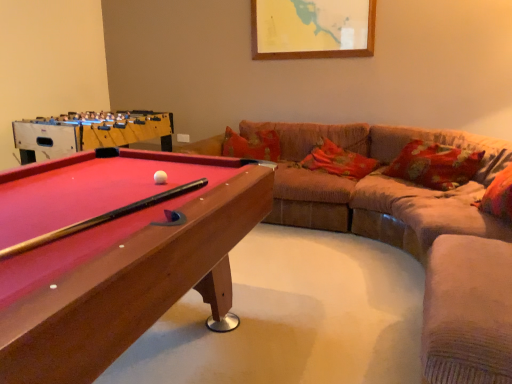
In order to face velvet beige couch at right, should I rotate leftwards or rightwards?

You should rotate right by 10.676 degrees.

Find the location of a particular element. Image resolution: width=512 pixels, height=384 pixels. wooden billiard table at left is located at coordinates (114, 254).

This screenshot has height=384, width=512. Describe the element at coordinates (338, 161) in the screenshot. I see `floral fabric pillow at center, the third pillow in the front-to-back sequence` at that location.

This screenshot has width=512, height=384. What are the coordinates of `fluffy fabric pillow at right, which is the 1th pillow from front to back` in the screenshot? It's located at (498, 196).

From the picture: Does floral fabric pillow at center, the 1th pillow from the back, have a lesser height compared to velvet beige couch at right?

Correct, floral fabric pillow at center, the 1th pillow from the back, is not as tall as velvet beige couch at right.

From a real-world perspective, is floral fabric pillow at center, the 1th pillow from the back, physically above velvet beige couch at right?

Correct, in the physical world, floral fabric pillow at center, the 1th pillow from the back, is higher than velvet beige couch at right.

Measure the distance between floral fabric pillow at center, the third pillow in the front-to-back sequence, and velvet beige couch at right.

floral fabric pillow at center, the third pillow in the front-to-back sequence, is 18.41 inches away from velvet beige couch at right.

Is floral fabric pillow at center, the 1th pillow from the back, beside velvet beige couch at right?

No, floral fabric pillow at center, the 1th pillow from the back, is not beside velvet beige couch at right.

Considering the sizes of objects velvet beige couch at right and white matte ball at center in the image provided, who is shorter, velvet beige couch at right or white matte ball at center?

white matte ball at center is shorter.

Is velvet beige couch at right thinner than white matte ball at center?

No.

Considering the sizes of velvet beige couch at right and white matte ball at center in the image, is velvet beige couch at right bigger or smaller than white matte ball at center?

In the image, velvet beige couch at right appears to be larger than white matte ball at center.

Is the position of smooth wood pool table at left more distant than that of fluffy fabric pillow at right, the third pillow in the back-to-front sequence?

Yes, it is.

Between point (48, 154) and point (494, 216), which one is positioned in front?

Positioned in front is point (494, 216).

Which object is positioned more to the left, smooth wood pool table at left or fluffy fabric pillow at right, the third pillow in the back-to-front sequence?

smooth wood pool table at left is more to the left.

How different are the orientations of smooth wood pool table at left and fluffy fabric pillow at right, the third pillow in the back-to-front sequence, in degrees?

162 degrees separate the facing orientations of smooth wood pool table at left and fluffy fabric pillow at right, the third pillow in the back-to-front sequence.

Can you confirm if smooth wood pool table at left is taller than suede-like beige swivel chair at lower right?

Yes, smooth wood pool table at left is taller than suede-like beige swivel chair at lower right.

What's the angular difference between smooth wood pool table at left and suede-like beige swivel chair at lower right's facing directions?

178 degrees separate the facing orientations of smooth wood pool table at left and suede-like beige swivel chair at lower right.

How distant is smooth wood pool table at left from suede-like beige swivel chair at lower right?

They are 2.59 meters apart.

Could you tell me if smooth wood pool table at left is turned towards suede-like beige swivel chair at lower right?

Yes.

Does velvet beige couch at right have a lesser height compared to floral fabric pillow at center, the 1th pillow from the back?

In fact, velvet beige couch at right may be taller than floral fabric pillow at center, the 1th pillow from the back.

From a real-world perspective, who is located lower, velvet beige couch at right or floral fabric pillow at center, the 1th pillow from the back?

In real-world perspective, velvet beige couch at right is lower.

From the image's perspective, is velvet beige couch at right above floral fabric pillow at center, the 1th pillow from the back?

No.

Can you tell me how much floral fabric pillow at center, the third pillow in the front-to-back sequence, and fluffy fabric pillow at right, the third pillow in the back-to-front sequence, differ in facing direction?

floral fabric pillow at center, the third pillow in the front-to-back sequence, and fluffy fabric pillow at right, the third pillow in the back-to-front sequence, are facing 81.6 degrees away from each other.

From a real-world perspective, is floral fabric pillow at center, the 1th pillow from the back, positioned over fluffy fabric pillow at right, the third pillow in the back-to-front sequence, based on gravity?

No, from a real-world perspective, floral fabric pillow at center, the 1th pillow from the back, is not over fluffy fabric pillow at right, the third pillow in the back-to-front sequence

In terms of size, does floral fabric pillow at center, the 1th pillow from the back, appear bigger or smaller than fluffy fabric pillow at right, which is the 1th pillow from front to back?

floral fabric pillow at center, the 1th pillow from the back, is bigger than fluffy fabric pillow at right, which is the 1th pillow from front to back.

Is floral fabric pillow at center, the 1th pillow from the back, not close to fluffy fabric pillow at right, the third pillow in the back-to-front sequence?

That's right, there is a large distance between floral fabric pillow at center, the 1th pillow from the back, and fluffy fabric pillow at right, the third pillow in the back-to-front sequence.

From the image's perspective, is floral fabric pillow at right, the 2th pillow positioned from the back, beneath suede-like beige swivel chair at lower right?

No, from the image's perspective, floral fabric pillow at right, the 2th pillow positioned from the back, is not below suede-like beige swivel chair at lower right.

Based on the photo, in the image, is floral fabric pillow at right, positioned as the 2th pillow in front-to-back order, on the left side or the right side of suede-like beige swivel chair at lower right?

floral fabric pillow at right, positioned as the 2th pillow in front-to-back order, is positioned on suede-like beige swivel chair at lower right's right side.

Is floral fabric pillow at right, the 2th pillow positioned from the back, oriented away from suede-like beige swivel chair at lower right?

No, floral fabric pillow at right, the 2th pillow positioned from the back, is not facing away from suede-like beige swivel chair at lower right.

Between floral fabric pillow at right, the 2th pillow positioned from the back, and suede-like beige swivel chair at lower right, which one has smaller width?

Thinner between the two is floral fabric pillow at right, the 2th pillow positioned from the back.

Which pillow is the 1st one when counting from the right side of the velvet beige couch at right? Please provide its 2D coordinates.

[(338, 161)]

The height and width of the screenshot is (384, 512). I want to click on ball below the velvet beige couch at right (from the image's perspective), so click(160, 177).

From the image, which object appears to be nearer to velvet beige couch at right, smooth wood pool table at left or white matte ball at center?

Based on the image, smooth wood pool table at left appears to be nearer to velvet beige couch at right.

Based on the photo, from the image, which object appears to be nearer to floral fabric pillow at right, positioned as the 2th pillow in front-to-back order, velvet beige couch at right or floral fabric pillow at center, the 1th pillow from the back?

Based on the image, velvet beige couch at right appears to be nearer to floral fabric pillow at right, positioned as the 2th pillow in front-to-back order.

Estimate the real-world distances between objects in this image. Which object is closer to smooth wood pool table at left, white matte ball at center or floral fabric pillow at right, the 2th pillow positioned from the back?

white matte ball at center is positioned closer to the anchor smooth wood pool table at left.

Which object lies further to the anchor point wooden billiard table at left, suede-like beige swivel chair at lower right or velvet beige couch at right?

The object further to wooden billiard table at left is velvet beige couch at right.

Looking at the image, which one is located closer to floral fabric pillow at right, the 2th pillow positioned from the back, white matte ball at center or velvet beige couch at right?

velvet beige couch at right is positioned closer to the anchor floral fabric pillow at right, the 2th pillow positioned from the back.

Considering their positions, is floral fabric pillow at right, positioned as the 2th pillow in front-to-back order, positioned further to smooth wood pool table at left than fluffy fabric pillow at right, which is the 1th pillow from front to back?

fluffy fabric pillow at right, which is the 1th pillow from front to back, lies further to smooth wood pool table at left than the other object.

Estimate the real-world distances between objects in this image. Which object is further from floral fabric pillow at center, the third pillow in the front-to-back sequence, floral fabric pillow at right, positioned as the 2th pillow in front-to-back order, or velvet beige couch at right?

Among the two, velvet beige couch at right is located further to floral fabric pillow at center, the third pillow in the front-to-back sequence.

Based on their spatial positions, is wooden billiard table at left or floral fabric pillow at center, the 1th pillow from the back, further from velvet beige couch at right?

wooden billiard table at left is further to velvet beige couch at right.

Locate an element on the screen. studio couch situated between white matte ball at center and floral fabric pillow at right, the 2th pillow positioned from the back, from left to right is located at coordinates (415, 236).

Locate an element on the screen. swivel chair between wooden billiard table at left and floral fabric pillow at right, the 2th pillow positioned from the back, from front to back is located at coordinates (468, 311).

Locate an element on the screen. The width and height of the screenshot is (512, 384). ball between suede-like beige swivel chair at lower right and floral fabric pillow at center, the third pillow in the front-to-back sequence, in the front-back direction is located at coordinates (160, 177).

You are a GUI agent. You are given a task and a screenshot of the screen. Output one action in this format:
    pyautogui.click(x=<x>, y=<y>)
    Task: Click on the studio couch between white matte ball at center and floral fabric pillow at center, the third pillow in the front-to-back sequence, in the front-back direction
    This screenshot has width=512, height=384.
    Given the screenshot: What is the action you would take?
    pyautogui.click(x=415, y=236)